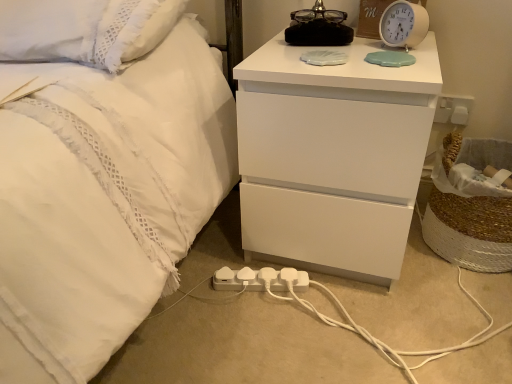
The height and width of the screenshot is (384, 512). I want to click on vacant area that is in front of woven straw laundry basket at lower right, so click(463, 312).